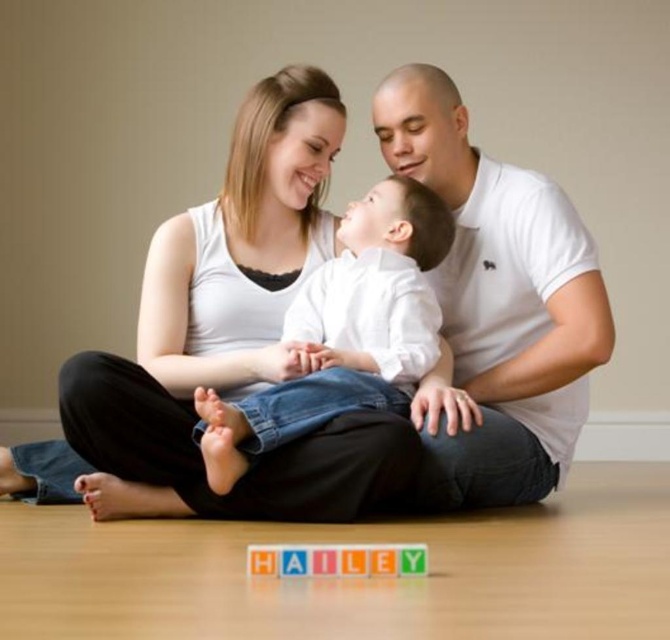
You are a photographer setting up for a family photo. You notice the white cotton shirt at center and the multicolored plastic blocks at center in the scene. Which object should you focus on if you want to capture the larger object in your shot?

The white cotton shirt at center is larger in size than the multicolored plastic blocks at center, so you should focus on the white cotton shirt at center to capture the larger object.

You are standing in the room and see two points marked on the floor. The first point is at coordinates point (364, 324) and the second point is at point (360, 550). If you are facing north, which point is located behind the other?

Point (364, 324) is behind point (360, 550).

You are a photographer setting up for a family photo. You notice the white smooth shirt at center and the multicolored plastic blocks at center. To ensure both are in focus, you need to know which object is wider. Can you determine which one has a greater width?

The white smooth shirt at center might be wider than multicolored plastic blocks at center, so it is possible that the white smooth shirt at center has a greater width.